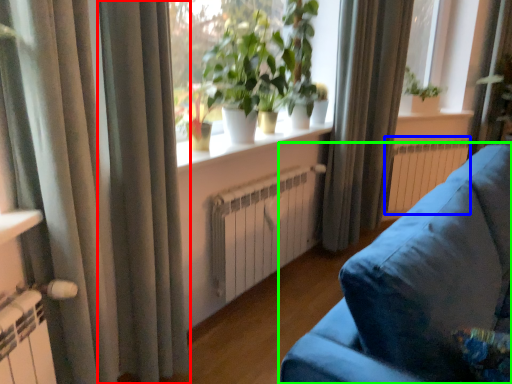
Question: Estimate the real-world distances between objects in this image. Which object is farther from curtain (highlighted by a red box), radiator (highlighted by a blue box) or studio couch (highlighted by a green box)?

Choices:
 (A) radiator
 (B) studio couch

Answer: (A)